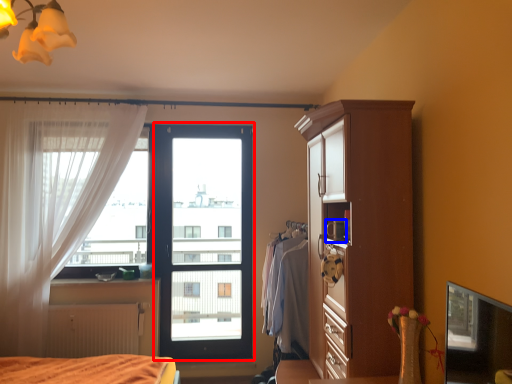
Question: Among these objects, which one is nearest to the camera, screen door (highlighted by a red box) or appliance (highlighted by a blue box)?

Choices:
 (A) screen door
 (B) appliance

Answer: (B)